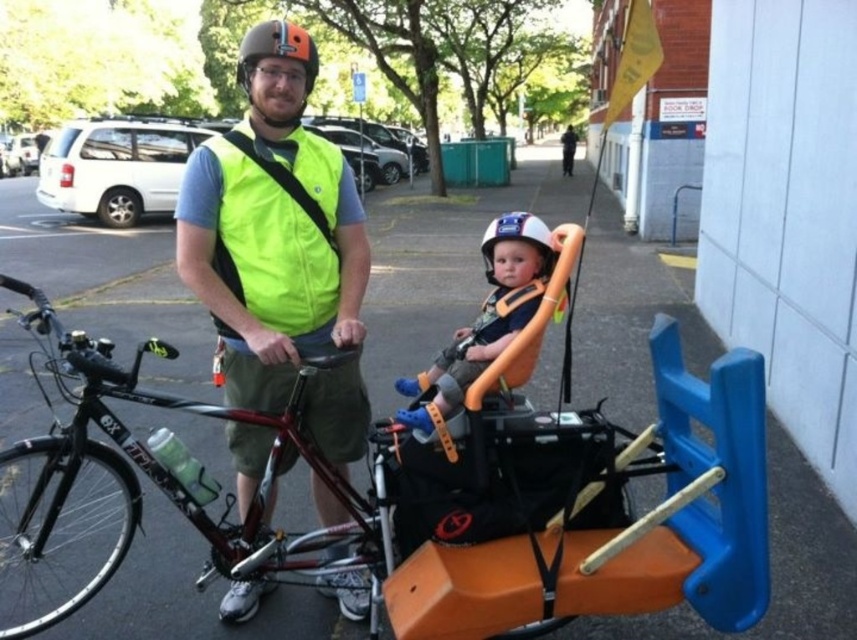
You are a delivery person who needs to secure a package between the shiny black frame at center and the matte orange helmet at upper center. Can you fit a 3.5 feet long package between them?

The distance between the shiny black frame at center and the matte orange helmet at upper center is 3.70 feet, so yes, the 3.5 feet long package can fit between them since it is shorter than the available space.

You are a pedestrian standing in the parking lot and see the neon yellow fabric safety vest at center and the matte orange helmet at upper center. Which object is closer to you?

The neon yellow fabric safety vest at center is closer to you because it is further to the viewer than the matte orange helmet at upper center.

You are a delivery driver who needs to secure a package on the shiny black frame at center without blocking the matte orange helmet at upper center. Based on their positions, which object should you place the package closer to?

The shiny black frame at center is positioned on the left side of the matte orange helmet at upper center, so you should place the package closer to the left side of the shiny black frame at center to avoid blocking the helmet.